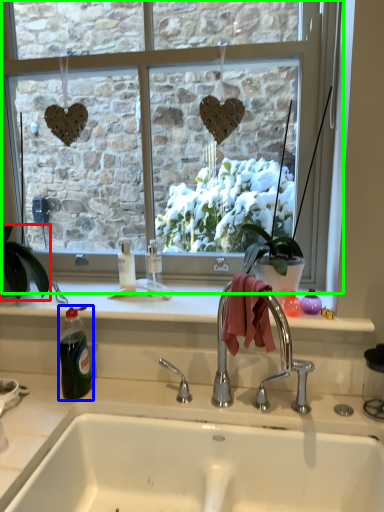
Question: Which object is positioned closest to houseplant (highlighted by a red box)? Select from bottle (highlighted by a blue box) and window (highlighted by a green box).

Choices:
 (A) bottle
 (B) window

Answer: (A)